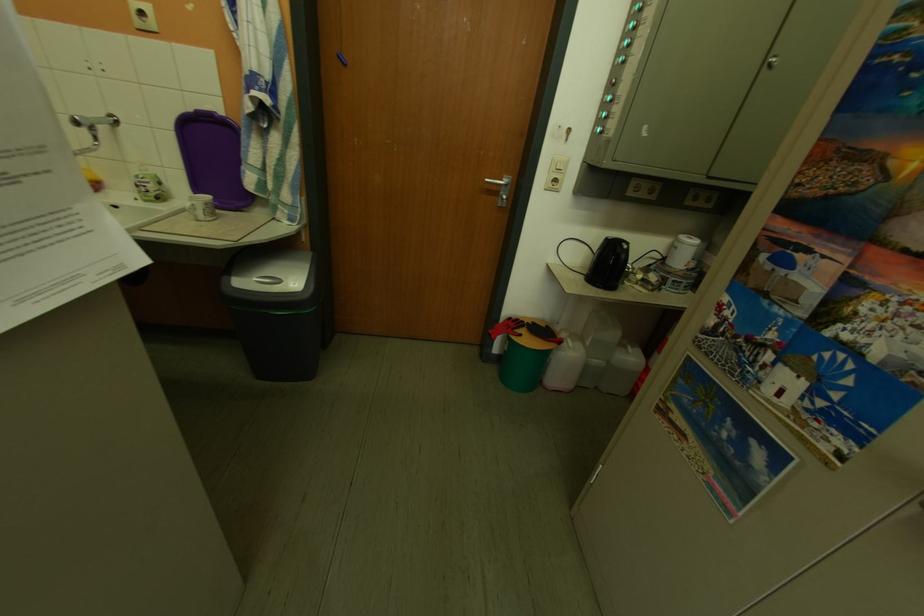
The height and width of the screenshot is (616, 924). What do you see at coordinates (271, 270) in the screenshot?
I see `the trash can lid` at bounding box center [271, 270].